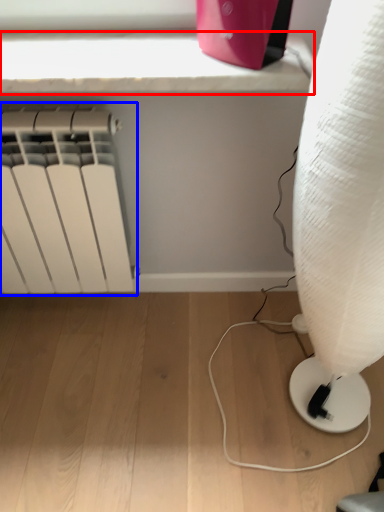
Question: Which object is further to the camera taking this photo, window sill (highlighted by a red box) or radiator (highlighted by a blue box)?

Choices:
 (A) window sill
 (B) radiator

Answer: (B)